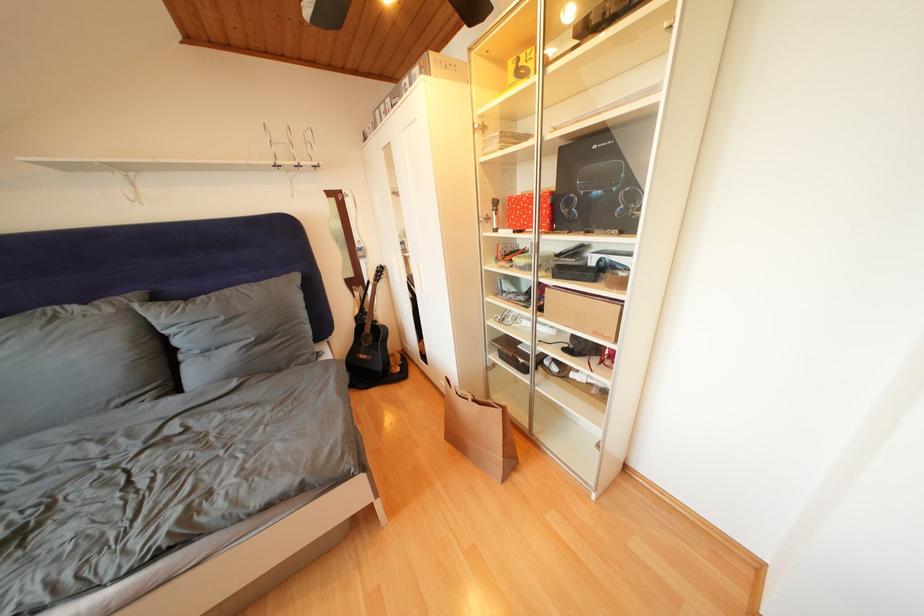
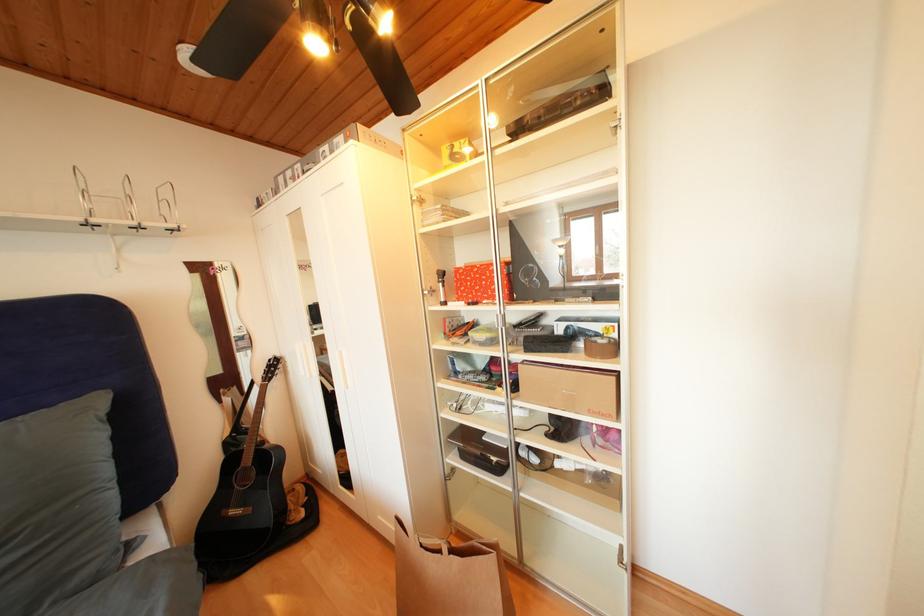
What movement of the cameraman would produce the second image?

The cameraman moved toward left, forward.